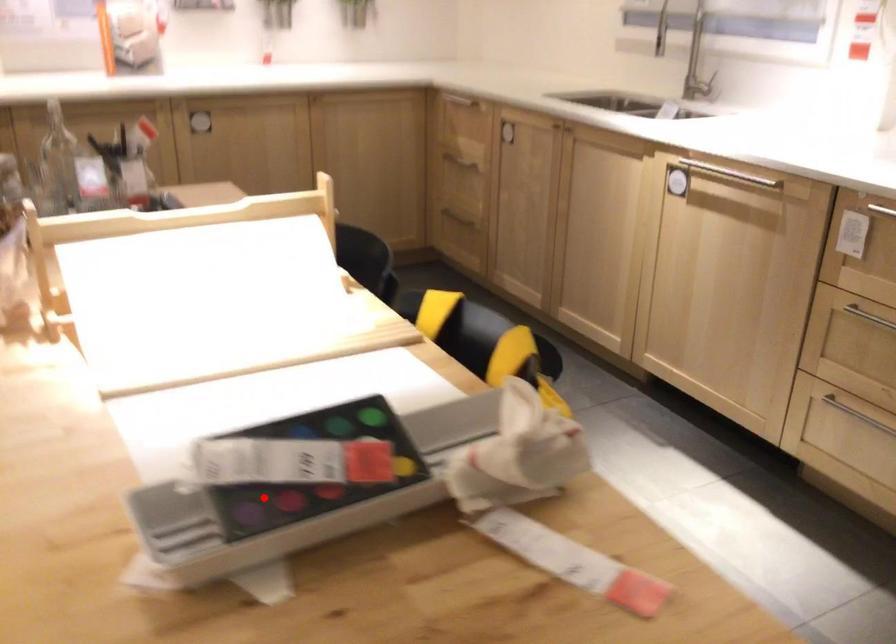
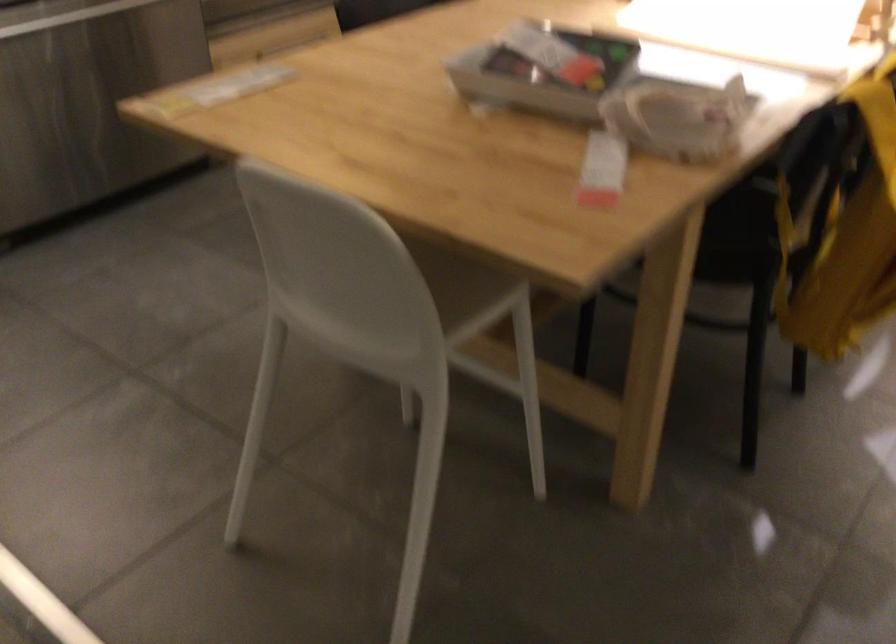
In the second image, find the point that corresponds to the highlighted location in the first image.

(544, 73)